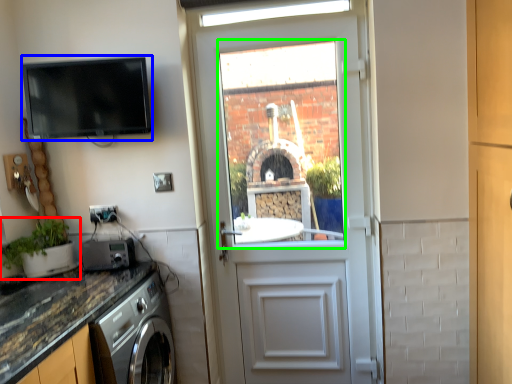
Question: Which object is the closest to the houseplant (highlighted by a red box)? Choose among these: appliance (highlighted by a blue box) or window (highlighted by a green box).

Choices:
 (A) appliance
 (B) window

Answer: (A)